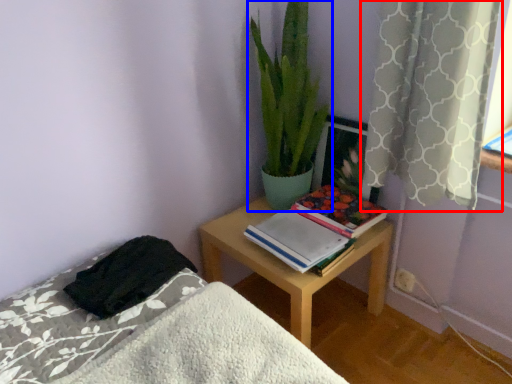
Question: Which point is closer to the camera, curtain (highlighted by a red box) or houseplant (highlighted by a blue box)?

Choices:
 (A) curtain
 (B) houseplant

Answer: (A)